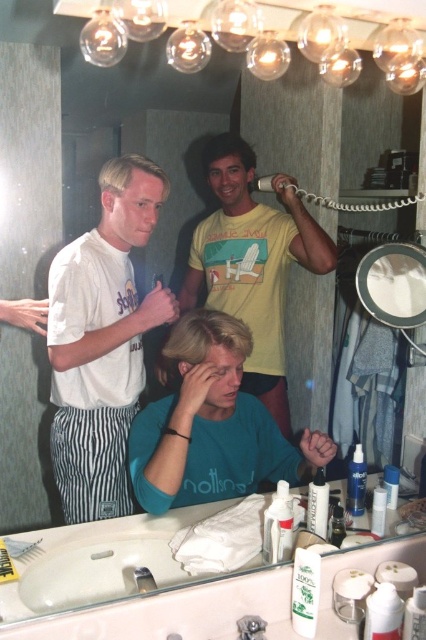
You are standing in the bathroom and want to reach both points in the scene. Which point, point 1 at coordinates (253, 324) or point 2 at coordinates (68, 600), will you reach first if you move towards them?

Point 1 at coordinates 0.508, 0.590 is closer to you than point 2 at coordinates (68, 600), so you will reach point 1 first.

Based on the scene description, where is the blonde hair at upper left located in the image?

The blonde hair at upper left is located at point coordinates of (129, 173).

Consider the image. You are trying to decide which item to grab first from the bathroom counter. The teal matte shirt at center and the blonde hair at upper left are both within reach. Which one takes up more horizontal space?

The teal matte shirt at center might be wider than blonde hair at upper left, so it likely takes up more horizontal space.